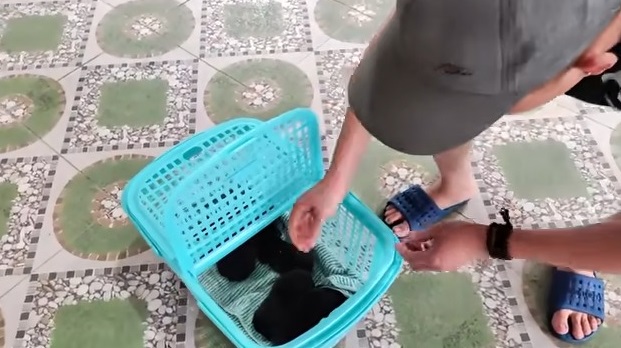
Locate an element on the screen. The width and height of the screenshot is (621, 348). towel in basket is located at coordinates (243, 305).